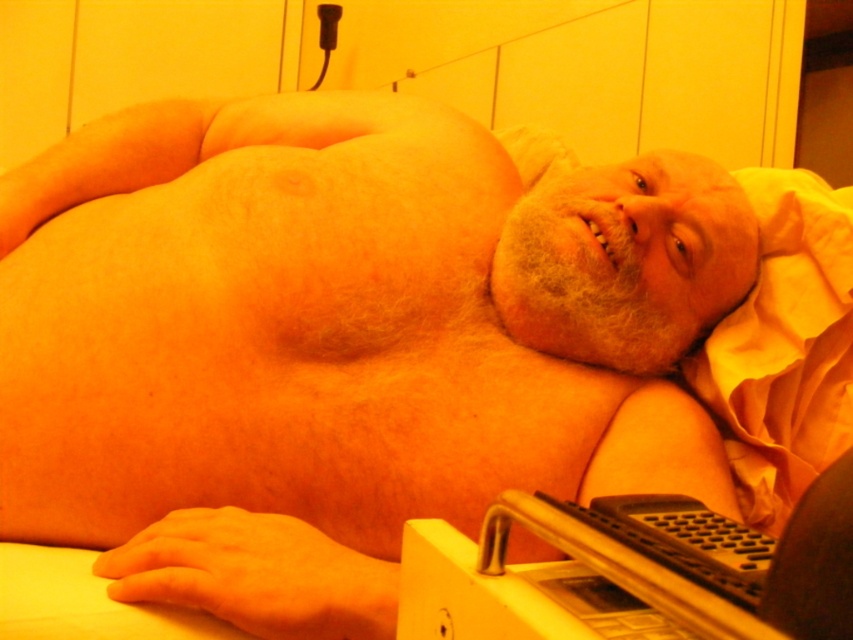
Can you confirm if black plastic laptop at lower right is positioned above yellow fabric pillow at right?

Actually, black plastic laptop at lower right is below yellow fabric pillow at right.

Describe the element at coordinates (634, 572) in the screenshot. Image resolution: width=853 pixels, height=640 pixels. I see `black plastic laptop at lower right` at that location.

This screenshot has width=853, height=640. What do you see at coordinates (634, 572) in the screenshot?
I see `black plastic laptop at lower right` at bounding box center [634, 572].

Locate an element on the screen. The image size is (853, 640). black plastic laptop at lower right is located at coordinates (634, 572).